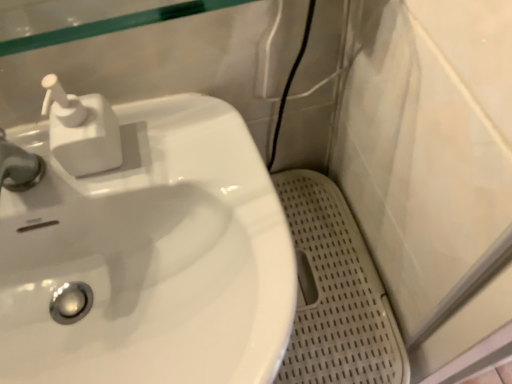
Question: Is white plastic soap dispenser at upper left at the left side of white perforated mat at lower right?

Choices:
 (A) yes
 (B) no

Answer: (A)

Question: Can you confirm if white plastic soap dispenser at upper left is smaller than white perforated mat at lower right?

Choices:
 (A) no
 (B) yes

Answer: (B)

Question: Is white plastic soap dispenser at upper left next to white perforated mat at lower right?

Choices:
 (A) no
 (B) yes

Answer: (A)

Question: Does white plastic soap dispenser at upper left have a larger size compared to white perforated mat at lower right?

Choices:
 (A) no
 (B) yes

Answer: (A)

Question: Can you confirm if white plastic soap dispenser at upper left is thinner than white perforated mat at lower right?

Choices:
 (A) no
 (B) yes

Answer: (B)

Question: Would you say white perforated mat at lower right is to the left or to the right of white plastic soap dispenser at upper left in the picture?

Choices:
 (A) right
 (B) left

Answer: (A)

Question: From a real-world perspective, is white perforated mat at lower right positioned above or below white plastic soap dispenser at upper left?

Choices:
 (A) below
 (B) above

Answer: (A)

Question: Considering the positions of white perforated mat at lower right and white plastic soap dispenser at upper left in the image, is white perforated mat at lower right wider or thinner than white plastic soap dispenser at upper left?

Choices:
 (A) thin
 (B) wide

Answer: (B)

Question: From their relative heights in the image, would you say white perforated mat at lower right is taller or shorter than white plastic soap dispenser at upper left?

Choices:
 (A) tall
 (B) short

Answer: (A)

Question: Relative to white perforated mat at lower right, is white glossy sink at left in front or behind?

Choices:
 (A) behind
 (B) front

Answer: (B)

Question: Considering the positions of point (266, 299) and point (330, 253), is point (266, 299) closer or farther from the camera than point (330, 253)?

Choices:
 (A) farther
 (B) closer

Answer: (B)

Question: Which is correct: white glossy sink at left is inside white perforated mat at lower right, or outside of it?

Choices:
 (A) inside
 (B) outside

Answer: (B)

Question: Looking at the image, does white glossy sink at left seem bigger or smaller compared to white perforated mat at lower right?

Choices:
 (A) big
 (B) small

Answer: (A)

Question: Based on their sizes in the image, would you say white plastic soap dispenser at upper left is bigger or smaller than white perforated mat at lower right?

Choices:
 (A) big
 (B) small

Answer: (B)

Question: Considering their positions, is white plastic soap dispenser at upper left located in front of or behind white perforated mat at lower right?

Choices:
 (A) front
 (B) behind

Answer: (A)